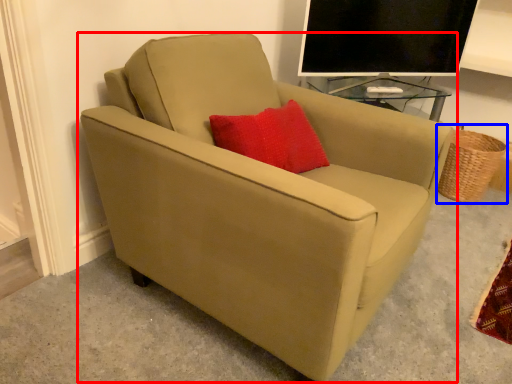
Question: Which point is further to the camera, chair (highlighted by a red box) or basket (highlighted by a blue box)?

Choices:
 (A) chair
 (B) basket

Answer: (B)